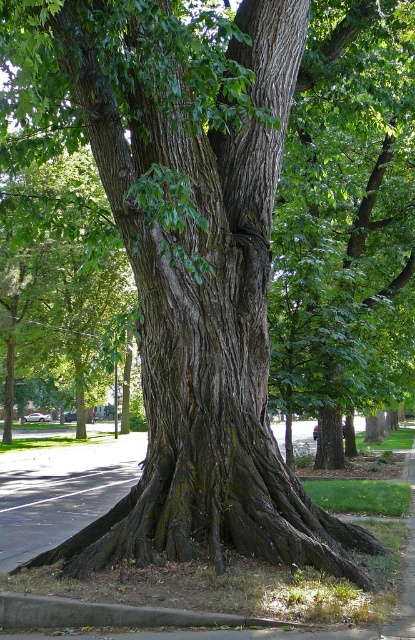
You are a delivery person with a 20 inch wide box. You need to place it between the gray asphalt at lower left and the gray concrete curb at lower center. Can the box fit in the space between them?

The distance between the gray asphalt at lower left and the gray concrete curb at lower center is 21.24 inches. Since the box is 20 inches wide, it can fit in the space between them.

You are a delivery person trying to park your bike. You see the gray asphalt at lower left and the gray concrete curb at lower center. Which surface can you use to park your bike without taking up too much space?

A: The gray asphalt at lower left is smaller than the gray concrete curb at lower center, so you can park your bike on the gray asphalt at lower left since it requires less space.